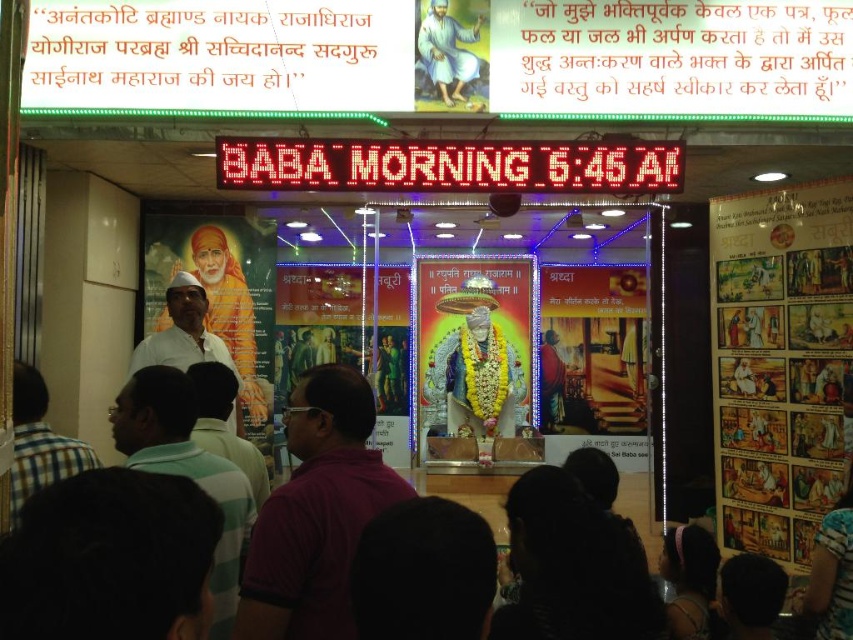
You are standing in the temple and want to take a photo of the central statue. The temple has a rule that you must stay at least 5 meters away from the statue. Is your current position at point (421, 72) within the allowed distance?

The distance of point (421, 72) from camera is 7.02 meters, which is more than the required 5 meters. Therefore, your current position is within the allowed distance.

You are an event organizer arranging decorations for the gathering. You have a white cloth at upper center and a white cotton shirt at center. Which item takes up more space in the scene?

The white cotton shirt at center occupies more space than the white cloth at upper center.

What are the coordinates of the purple cotton shirt at center?

The coordinates of the purple cotton shirt at center are at point (x=316, y=513).